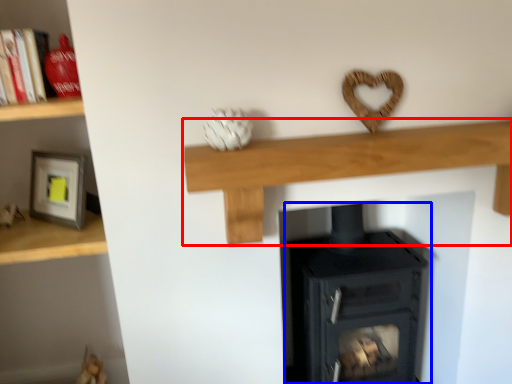
Question: Which object is closer to the camera taking this photo, shelf (highlighted by a red box) or wood burning stove (highlighted by a blue box)?

Choices:
 (A) shelf
 (B) wood burning stove

Answer: (A)